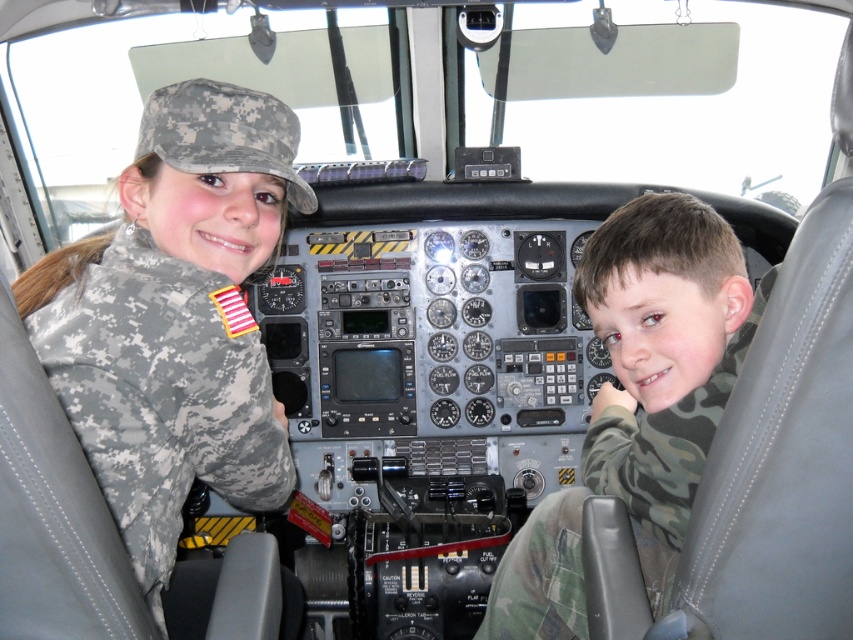
Does camouflage uniform at left appear on the right side of camouflage fabric shirt at center?

No, camouflage uniform at left is not to the right of camouflage fabric shirt at center.

Image resolution: width=853 pixels, height=640 pixels. What do you see at coordinates (175, 317) in the screenshot?
I see `camouflage uniform at left` at bounding box center [175, 317].

The width and height of the screenshot is (853, 640). In order to click on camouflage uniform at left in this screenshot , I will do `click(175, 317)`.